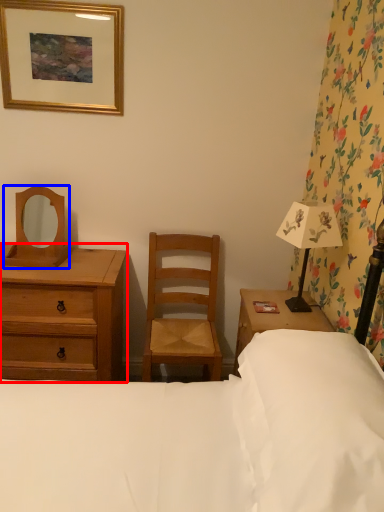
Question: Among these objects, which one is nearest to the camera, chest of drawers (highlighted by a red box) or mirror (highlighted by a blue box)?

Choices:
 (A) chest of drawers
 (B) mirror

Answer: (A)